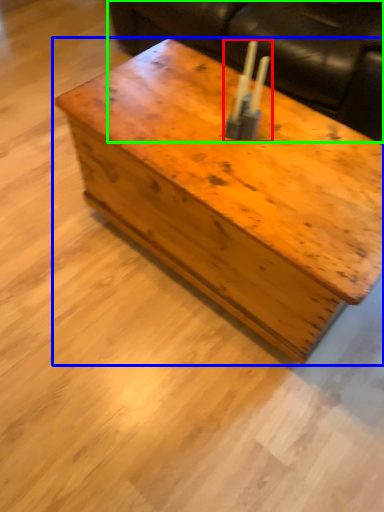
Question: Which is farther away from candle holder (highlighted by a red box)? table (highlighted by a blue box) or couch (highlighted by a green box)?

Choices:
 (A) table
 (B) couch

Answer: (B)